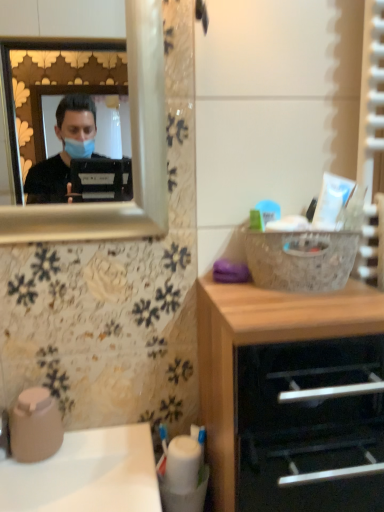
Question: From the image's perspective, is wooden chest of drawers at lower right above or below white glossy sink at lower left?

Choices:
 (A) above
 (B) below

Answer: (A)

Question: From a real-world perspective, is wooden chest of drawers at lower right above or below white glossy sink at lower left?

Choices:
 (A) below
 (B) above

Answer: (B)

Question: Is wooden chest of drawers at lower right taller or shorter than white glossy sink at lower left?

Choices:
 (A) short
 (B) tall

Answer: (B)

Question: Is white glossy sink at lower left bigger or smaller than wooden chest of drawers at lower right?

Choices:
 (A) big
 (B) small

Answer: (B)

Question: Is white glossy sink at lower left taller or shorter than wooden chest of drawers at lower right?

Choices:
 (A) tall
 (B) short

Answer: (B)

Question: Do you think white glossy sink at lower left is within wooden chest of drawers at lower right, or outside of it?

Choices:
 (A) outside
 (B) inside

Answer: (A)

Question: Does point (18, 492) appear closer or farther from the camera than point (240, 338)?

Choices:
 (A) closer
 (B) farther

Answer: (B)